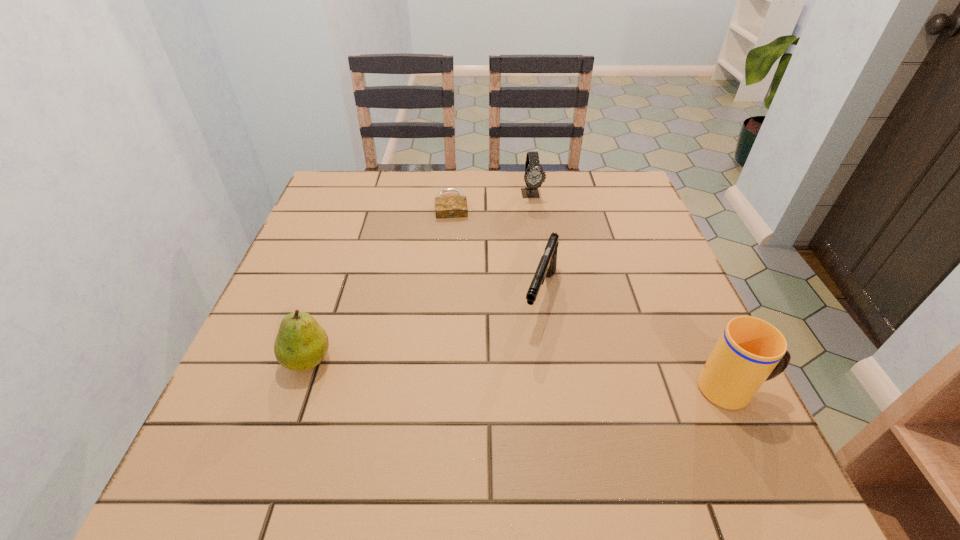
Where is `vacant region between the leftmost object and the padlock`? Image resolution: width=960 pixels, height=540 pixels. vacant region between the leftmost object and the padlock is located at coordinates (380, 282).

I want to click on unoccupied position between the padlock and the third nearest object, so click(496, 251).

Locate an element on the screen. The height and width of the screenshot is (540, 960). vacant region between the cup and the gun is located at coordinates (636, 343).

What are the coordinates of `vacant space that's between the leftmost object and the gun` in the screenshot? It's located at (424, 328).

Find the location of a particular element. The height and width of the screenshot is (540, 960). vacant area between the cup and the watch is located at coordinates (633, 292).

At what (x,y) coordinates should I click in order to perform the action: click on vacant area that lies between the leftmost object and the gun. Please return your answer as a coordinate pair (x, y). Looking at the image, I should click on (424, 328).

Identify the location of empty space that is in between the third nearest object and the rightmost object. (636, 343).

Where is `vacant point located between the padlock and the watch`? vacant point located between the padlock and the watch is located at coordinates (492, 199).

Locate an element on the screen. The width and height of the screenshot is (960, 540). vacant space that is in between the cup and the shortest object is located at coordinates pos(592,297).

Where is `object that is the closest one to the watch`? This screenshot has height=540, width=960. object that is the closest one to the watch is located at coordinates (446, 206).